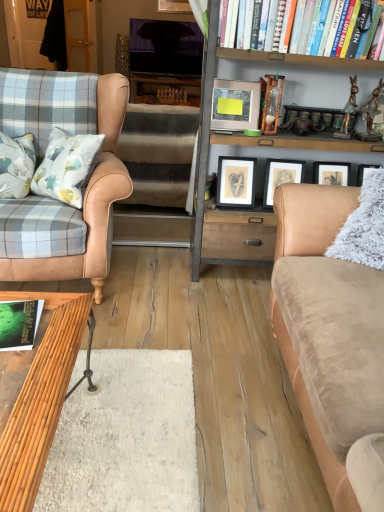
Question: Is green matte book at lower left, marked as the second book in a top-to-bottom arrangement, further to camera compared to tan leather chair at left?

Choices:
 (A) no
 (B) yes

Answer: (A)

Question: Is green matte book at lower left, positioned as the first book in front-to-back order, positioned before tan leather chair at left?

Choices:
 (A) no
 (B) yes

Answer: (B)

Question: Can you confirm if green matte book at lower left, which appears as the second book when viewed from the back, is smaller than tan leather chair at left?

Choices:
 (A) no
 (B) yes

Answer: (B)

Question: From the image's perspective, is green matte book at lower left, the 1th book positioned from the bottom, beneath tan leather chair at left?

Choices:
 (A) no
 (B) yes

Answer: (B)

Question: Is tan leather chair at left at the back of green matte book at lower left, which ranks as the first book in left-to-right order?

Choices:
 (A) no
 (B) yes

Answer: (A)

Question: In terms of size, does green matte book at lower left, marked as the second book in a top-to-bottom arrangement, appear bigger or smaller than brown plush stair at center?

Choices:
 (A) small
 (B) big

Answer: (A)

Question: From a real-world perspective, is green matte book at lower left, marked as the second book in a top-to-bottom arrangement, physically located above or below brown plush stair at center?

Choices:
 (A) below
 (B) above

Answer: (B)

Question: From the image's perspective, relative to brown plush stair at center, is green matte book at lower left, the second book viewed from the right, above or below?

Choices:
 (A) below
 (B) above

Answer: (A)

Question: Looking at their shapes, would you say green matte book at lower left, positioned as the first book in front-to-back order, is wider or thinner than brown plush stair at center?

Choices:
 (A) wide
 (B) thin

Answer: (B)

Question: Is green matte book at lower left, the 1th book positioned from the bottom, taller or shorter than bamboo wood coffee table at lower left?

Choices:
 (A) short
 (B) tall

Answer: (A)

Question: Is green matte book at lower left, which appears as the second book when viewed from the back, inside the boundaries of bamboo wood coffee table at lower left, or outside?

Choices:
 (A) inside
 (B) outside

Answer: (A)

Question: Considering the positions of green matte book at lower left, the 1th book positioned from the bottom, and bamboo wood coffee table at lower left in the image, is green matte book at lower left, the 1th book positioned from the bottom, bigger or smaller than bamboo wood coffee table at lower left?

Choices:
 (A) small
 (B) big

Answer: (A)

Question: From the image's perspective, is green matte book at lower left, the 1th book positioned from the bottom, located above or below bamboo wood coffee table at lower left?

Choices:
 (A) below
 (B) above

Answer: (B)

Question: Considering the positions of green matte book at lower left, which appears as the second book when viewed from the back, and matte silver picture frame at center, which ranks as the 1th picture frame in bottom-to-top order, in the image, is green matte book at lower left, which appears as the second book when viewed from the back, wider or thinner than matte silver picture frame at center, which ranks as the 1th picture frame in bottom-to-top order,?

Choices:
 (A) thin
 (B) wide

Answer: (B)

Question: Relative to matte silver picture frame at center, acting as the 2th picture frame starting from the back, is green matte book at lower left, the 1th book positioned from the bottom, in front or behind?

Choices:
 (A) front
 (B) behind

Answer: (A)